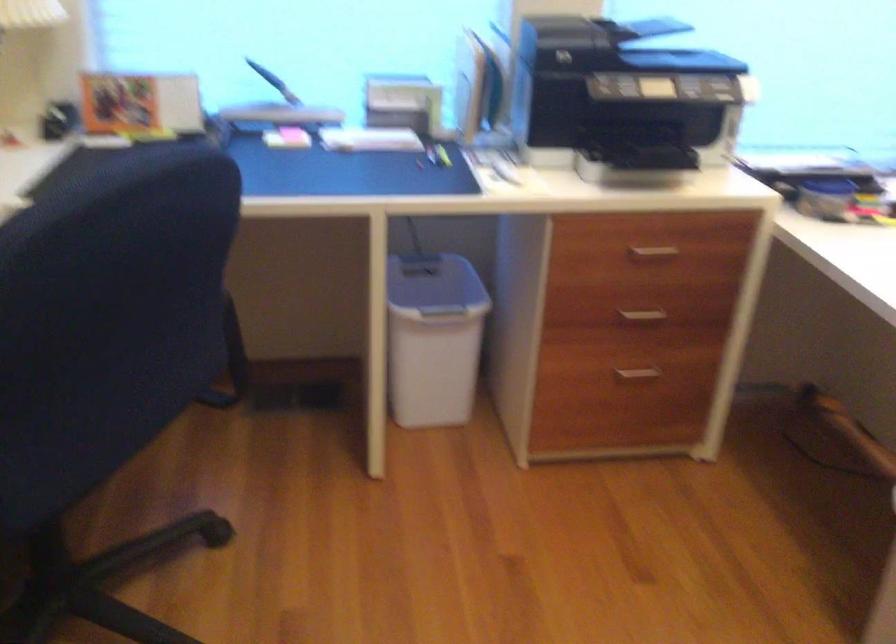
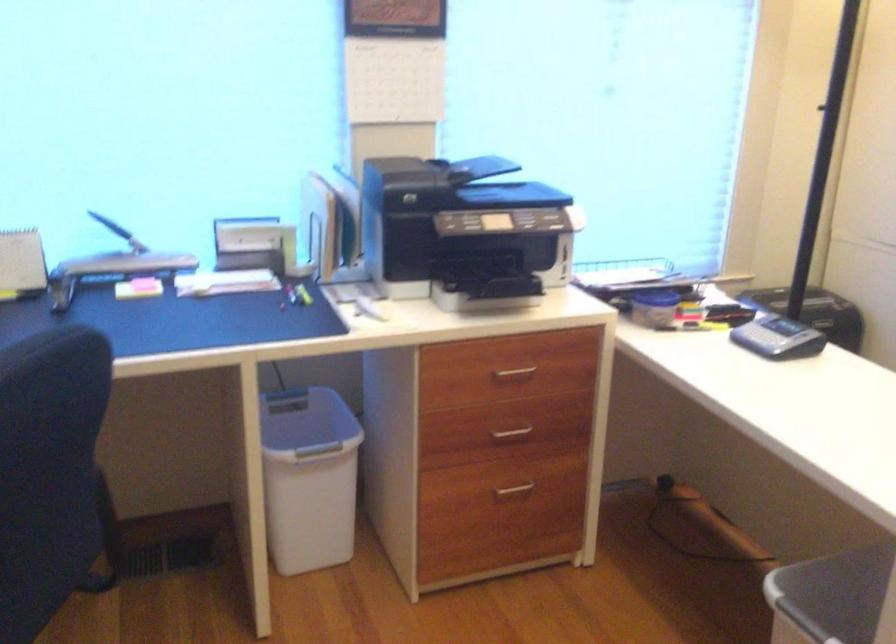
Where in the second image is the point corresponding to (638,375) from the first image?

(513, 489)